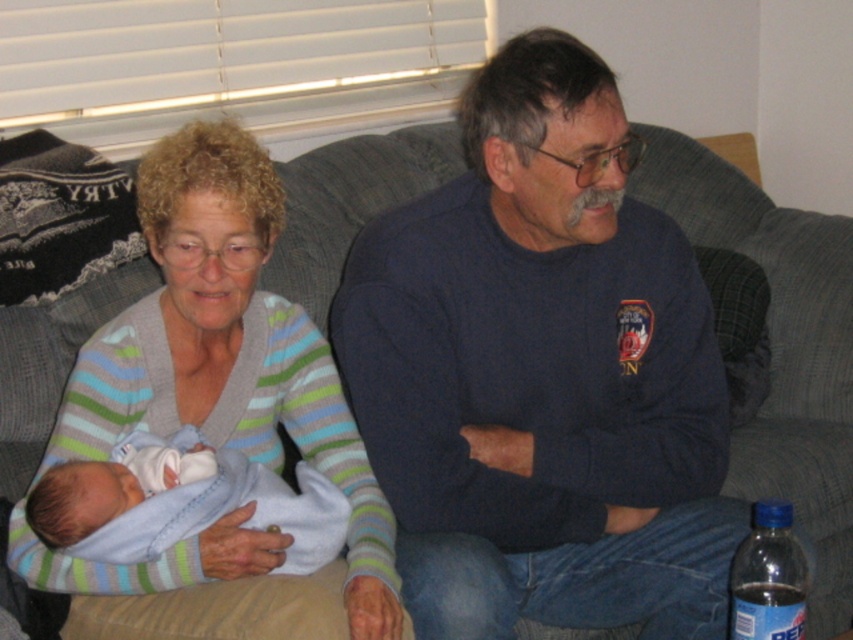
Question: Does light blue soft fabric newborn at center lie behind clear plastic bottle at lower right?

Choices:
 (A) no
 (B) yes

Answer: (B)

Question: Which object is closer to the camera taking this photo?

Choices:
 (A) clear plastic bottle at lower right
 (B) striped sweater at center
 (C) light blue soft fabric newborn at center
 (D) dark blue sweater at center

Answer: (A)

Question: Does striped sweater at center appear over light blue soft fabric newborn at center?

Choices:
 (A) no
 (B) yes

Answer: (B)

Question: Can you confirm if light blue soft fabric newborn at center is bigger than clear plastic bottle at lower right?

Choices:
 (A) yes
 (B) no

Answer: (B)

Question: Which point is farther to the camera?

Choices:
 (A) dark blue sweater at center
 (B) light blue soft fabric newborn at center
 (C) clear plastic bottle at lower right
 (D) striped sweater at center

Answer: (A)

Question: Which of these objects is positioned farthest from the light blue soft fabric newborn at center?

Choices:
 (A) dark blue sweater at center
 (B) clear plastic bottle at lower right
 (C) striped sweater at center

Answer: (B)